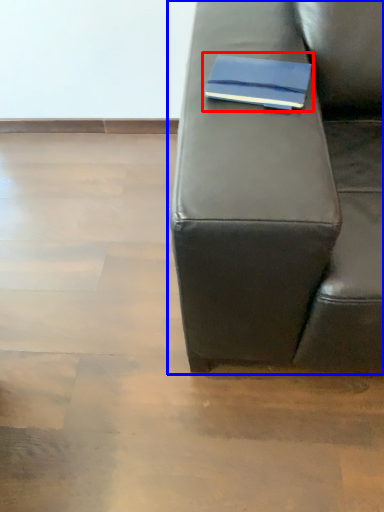
Question: Which object appears farthest to the camera in this image, paperback book (highlighted by a red box) or studio couch (highlighted by a blue box)?

Choices:
 (A) paperback book
 (B) studio couch

Answer: (A)